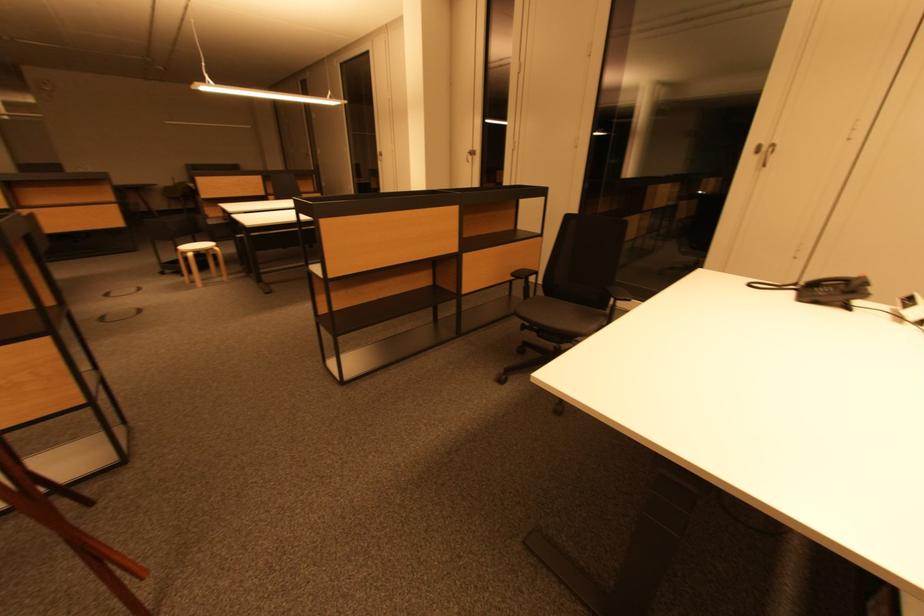
Image resolution: width=924 pixels, height=616 pixels. I want to click on black chair sitting surface, so click(573, 312).